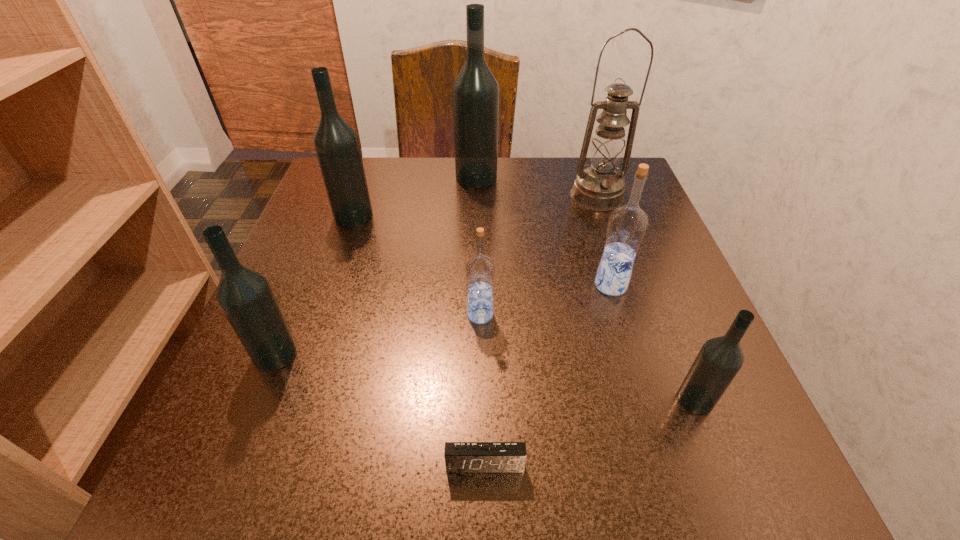
At what (x,y) coordinates should I click in order to perform the action: click on the fifth farthest object. Please return your answer as a coordinate pair (x, y). Looking at the image, I should click on (480, 270).

This screenshot has width=960, height=540. Find the location of `the smallest black vodka`. the smallest black vodka is located at coordinates (719, 360).

Image resolution: width=960 pixels, height=540 pixels. Identify the location of the nearest vodka. (719, 360).

You are a GUI agent. You are given a task and a screenshot of the screen. Output one action in this format:
    pyautogui.click(x=<x>, y=<y>)
    Task: Click on the alarm clock
    The height and width of the screenshot is (540, 960).
    Given the screenshot: What is the action you would take?
    pyautogui.click(x=460, y=457)

This screenshot has width=960, height=540. I want to click on the nearest object, so click(460, 457).

Identify the location of free location located on the right of the tallest vodka. This screenshot has width=960, height=540. (636, 178).

At what (x,y) coordinates should I click in order to perform the action: click on vacant space located 0.140m on the front of the oil lamp. Please return your answer as a coordinate pair (x, y). This screenshot has width=960, height=540. Looking at the image, I should click on (617, 254).

At what (x,y) coordinates should I click in order to perform the action: click on vacant space located on the right of the second farthest black vodka. Please return your answer as a coordinate pair (x, y). This screenshot has height=540, width=960. Looking at the image, I should click on (429, 216).

Locate an element on the screen. Image resolution: width=960 pixels, height=540 pixels. blank space located 0.050m on the back of the fourth farthest object is located at coordinates (602, 255).

Locate an element on the screen. The width and height of the screenshot is (960, 540). vacant area situated on the back of the third biggest black vodka is located at coordinates (298, 301).